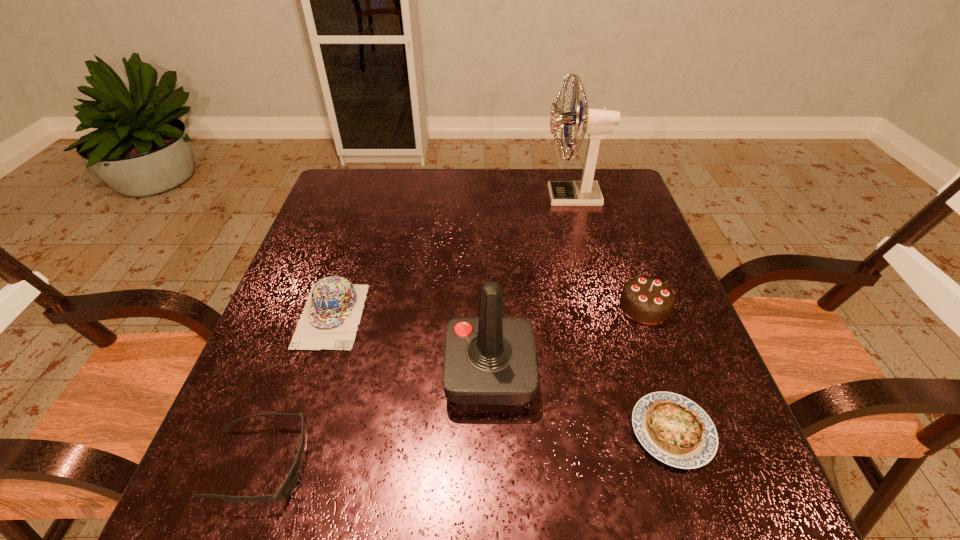
At what (x,y) coordinates should I click in order to perform the action: click on the farthest object. Please return your answer as a coordinate pair (x, y). The height and width of the screenshot is (540, 960). Looking at the image, I should click on (597, 123).

The width and height of the screenshot is (960, 540). Find the location of `fan`. fan is located at coordinates (597, 123).

Identify the location of the fourth object from right to left. (488, 360).

The width and height of the screenshot is (960, 540). I want to click on joystick, so click(x=488, y=360).

Where is `chocolate cake`? This screenshot has width=960, height=540. chocolate cake is located at coordinates (647, 300).

The image size is (960, 540). In order to click on the fourth tallest object in this screenshot , I will do `click(330, 319)`.

Identify the location of the fifth tallest object. The image size is (960, 540). (287, 487).

The width and height of the screenshot is (960, 540). What are the coordinates of `quiche` in the screenshot? It's located at (675, 430).

Locate an element on the screen. This screenshot has width=960, height=540. free space located 0.360m on the front-facing side of the farthest object is located at coordinates (422, 196).

Where is `vacant space located on the front-facing side of the farthest object`? This screenshot has width=960, height=540. vacant space located on the front-facing side of the farthest object is located at coordinates (479, 196).